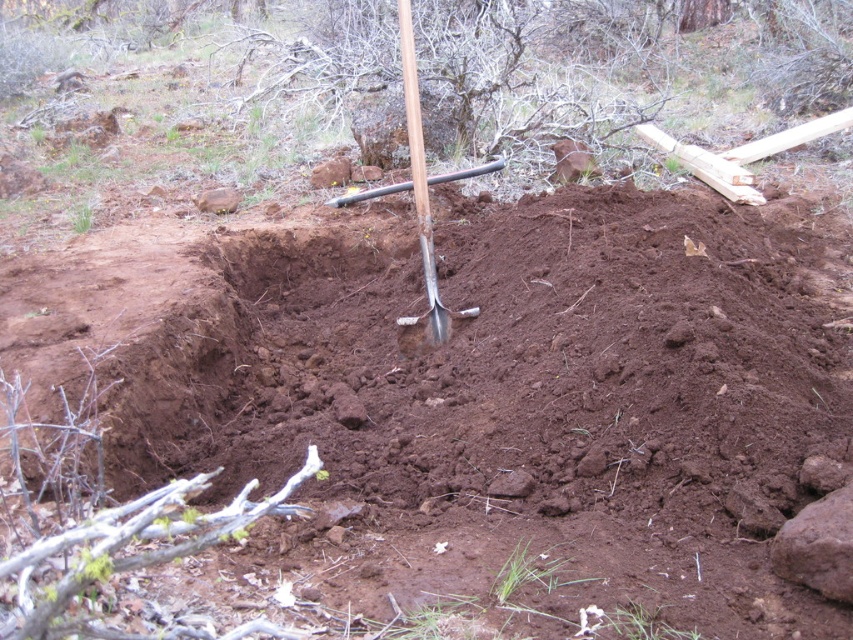
You are standing at the point labeled as point (370,346). You want to throw a small stone to reach the viewer who is 4.31 meters away. Is the distance within your throwing range if your maximum throw is 4 meters?

The distance between point (370,346) and the viewer is 4.31 meters, which is beyond your maximum throwing range of 4 meters. Therefore, you cannot reach the viewer with a single throw.

You are a gardener who needs to determine if the silver metallic shovel at center can be fully submerged into the brown soil at center. Based on their sizes, can the shovel be completely buried in the soil?

The brown soil at center is larger in size than the silver metallic shovel at center, so yes, the shovel can be fully submerged into the soil as there is enough space.

You are a gardener who needs to plant a row of flowers. You have a silver metallic shovel at center and notice the brown soil at center. Which object should you use to dig a hole for the flowers, and why?

You should use the silver metallic shovel at center to dig a hole for the flowers because the brown soil at center is the existing ground where you need to plant, not a tool.